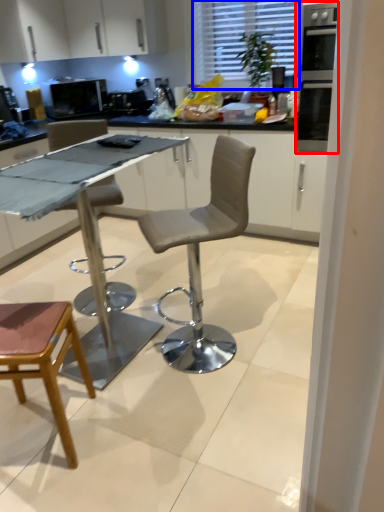
Question: Among these objects, which one is nearest to the camera, oven (highlighted by a red box) or window (highlighted by a blue box)?

Choices:
 (A) oven
 (B) window

Answer: (A)